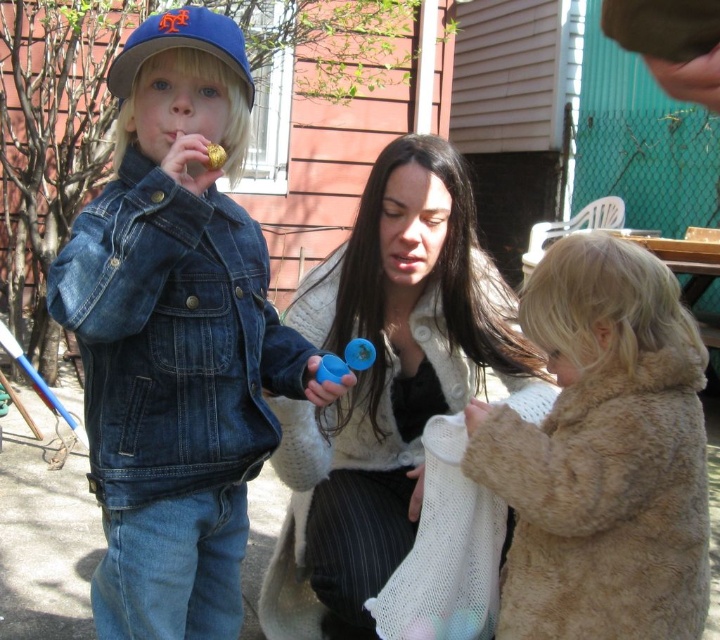
You are standing at the origin point of the coordinate system in the backyard scene. The point marked at coordinate (603, 454) is where the fuzzy beige coat at lower right is located. If you want to walk directly to the fuzzy beige coat at lower right, which direction should you move from your current position?

The point marked at coordinate (603, 454) indicates the location of the fuzzy beige coat at lower right. Since you are at the origin, you should move towards the lower right direction to reach it.

You are standing in the backyard and want to place a small item exactly at the location of the blue matte baseball cap at upper left. What are the coordinates where you should place it?

The blue matte baseball cap at upper left is located at point (180, 45), so you should place the item at those coordinates.

You are a photographer trying to capture a candid shot of the blue matte baseball cap at upper left and the blue plastic toy at center. Which object should you focus on first if you want to start with the one closer to the left edge of the frame?

The blue matte baseball cap at upper left should be focused on first because it is positioned on the left side of the blue plastic toy at center, making it closer to the left edge of the frame.